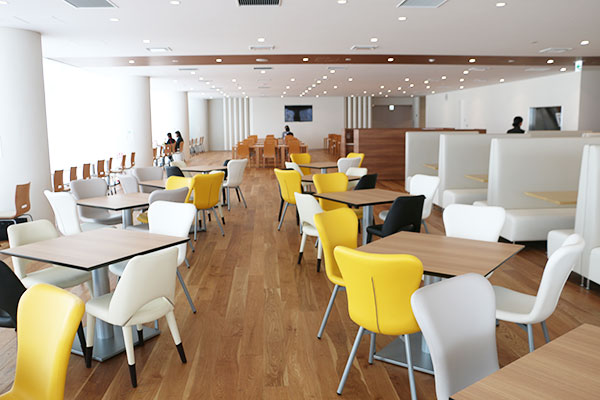
In order to click on booth benches in this screenshot , I will do `click(412, 167)`, `click(435, 195)`, `click(456, 180)`, `click(478, 200)`, `click(510, 187)`, `click(559, 233)`, `click(595, 256)`.